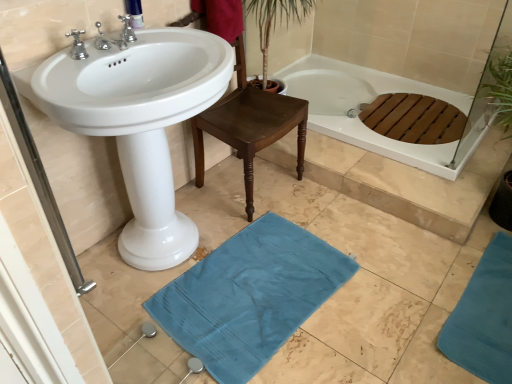
This screenshot has width=512, height=384. What are the coordinates of `free spot behind polished chrome faucet at upper center, which appears as the second tap when viewed from the front` in the screenshot? It's located at (142, 36).